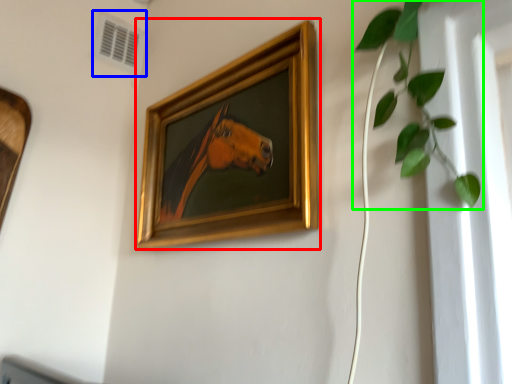
Question: Estimate the real-world distances between objects in this image. Which object is farther from picture frame (highlighted by a red box), air conditioning (highlighted by a blue box) or houseplant (highlighted by a green box)?

Choices:
 (A) air conditioning
 (B) houseplant

Answer: (A)